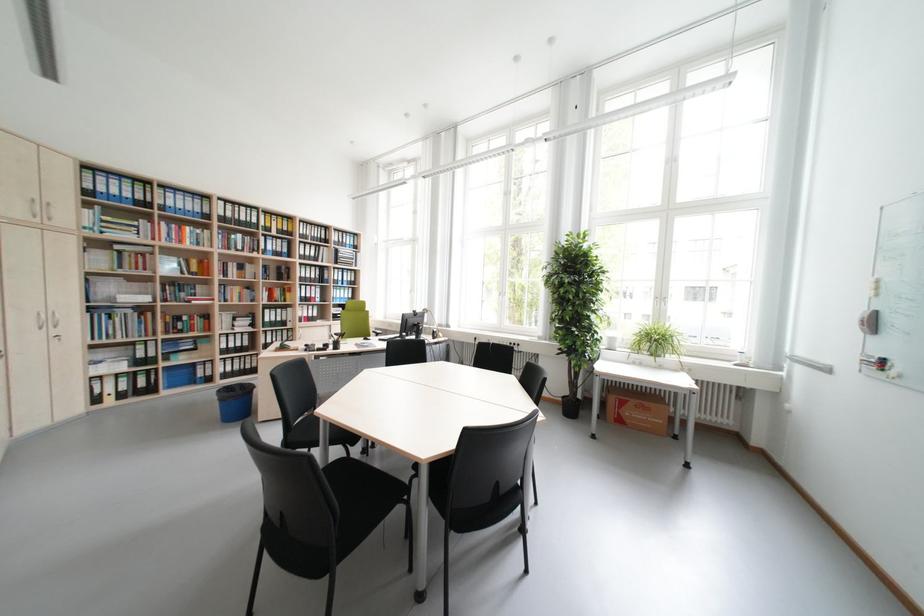
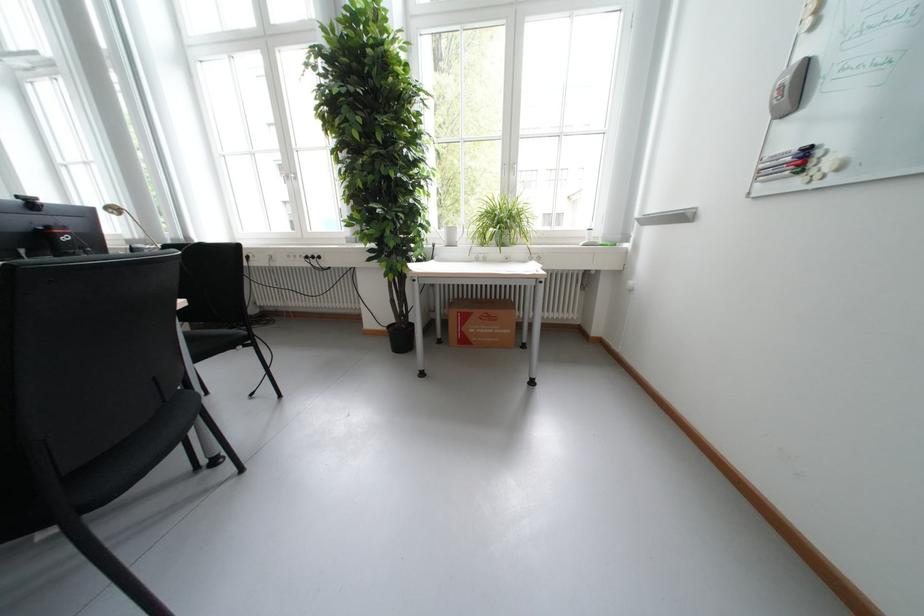
Where in the second image is the point corresponding to (622,341) from the first image?

(460, 233)